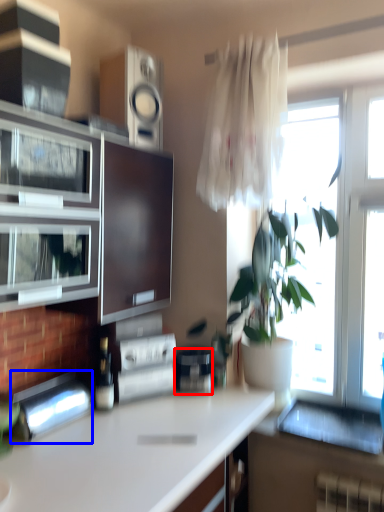
Question: Which object appears closest to the camera in this image, appliance (highlighted by a red box) or appliance (highlighted by a blue box)?

Choices:
 (A) appliance
 (B) appliance

Answer: (B)